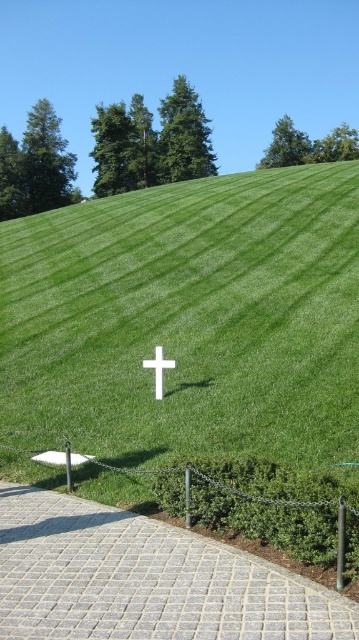
You are standing at the base of the grassy hill and want to reach the white cross at the center. According to the image, where is the gray cobblestone path at lower center located in relation to your current position?

The gray cobblestone path at lower center is located at point (145, 579) in the image, which means it is positioned to your right and slightly ahead as you face the hill.

You are a gardener planning to walk from the gray cobblestone path at lower center to the white matte cross at center. Which object is wider so you can choose the wider path for easier movement?

The gray cobblestone path at lower center is wider than the white matte cross at center, so you should choose the gray cobblestone path at lower center for easier movement.

You are standing at the point marked as point (145, 579) in the image. What object are you currently standing on?

You are standing on the gray cobblestone path at lower center.